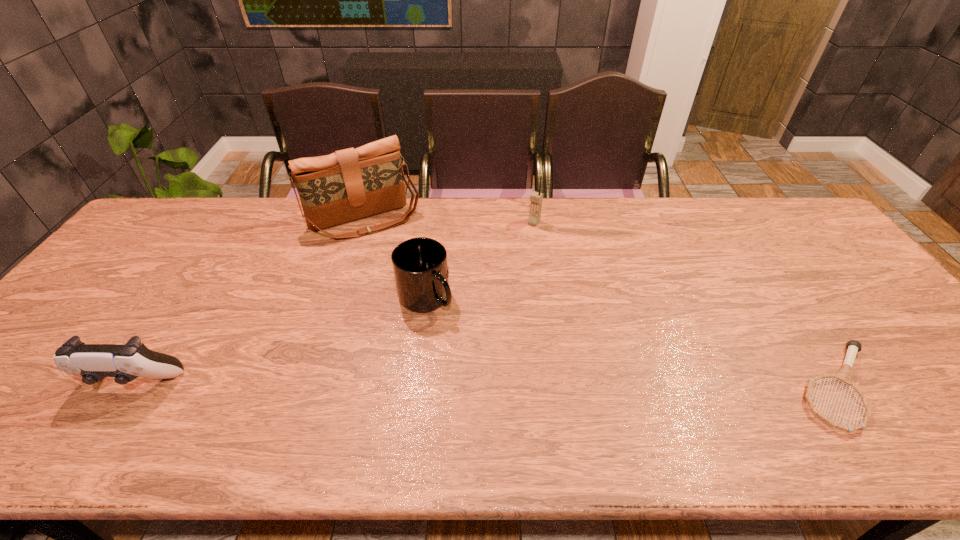
Where is `free space located with the handle on the side of the mug`? This screenshot has width=960, height=540. free space located with the handle on the side of the mug is located at coordinates (492, 400).

You are a GUI agent. You are given a task and a screenshot of the screen. Output one action in this format:
    pyautogui.click(x=<x>, y=<y>)
    Task: Click on the vacant region located on the front of the second tallest object, where the keypad is located
    
    Given the screenshot: What is the action you would take?
    pyautogui.click(x=493, y=283)

The image size is (960, 540). In order to click on vacant space located on the front of the second tallest object, where the keypad is located in this screenshot , I will do `click(518, 246)`.

The height and width of the screenshot is (540, 960). I want to click on vacant space located on the front of the second tallest object, where the keypad is located, so click(479, 304).

The image size is (960, 540). What are the coordinates of `vacant space located on the front-facing side of the shoulder bag` in the screenshot? It's located at (394, 256).

You are a GUI agent. You are given a task and a screenshot of the screen. Output one action in this format:
    pyautogui.click(x=<x>, y=<y>)
    Task: Click on the free location located on the front-facing side of the shoulder bag
    The image size is (960, 540).
    Given the screenshot: What is the action you would take?
    pyautogui.click(x=427, y=320)

Where is `vacant space located 0.080m on the front-facing side of the shoulder bag`? The width and height of the screenshot is (960, 540). vacant space located 0.080m on the front-facing side of the shoulder bag is located at coordinates (394, 256).

Locate an element on the screen. cellular telephone present at the far edge is located at coordinates (536, 198).

Identify the location of shoulder bag that is at the far edge. (350, 184).

Find the location of a particular element. The width and height of the screenshot is (960, 540). control that is at the near edge is located at coordinates (93, 362).